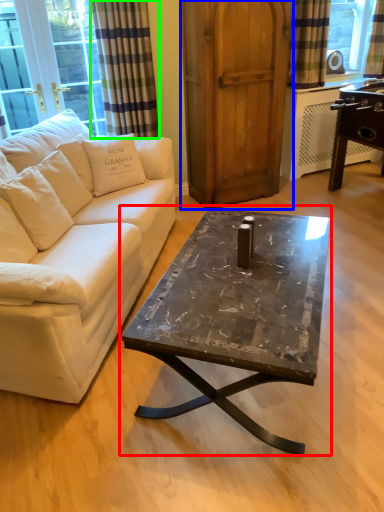
Question: Which object is the closest to the coffee table (highlighted by a red box)? Choose among these: armoire (highlighted by a blue box) or curtain (highlighted by a green box).

Choices:
 (A) armoire
 (B) curtain

Answer: (A)